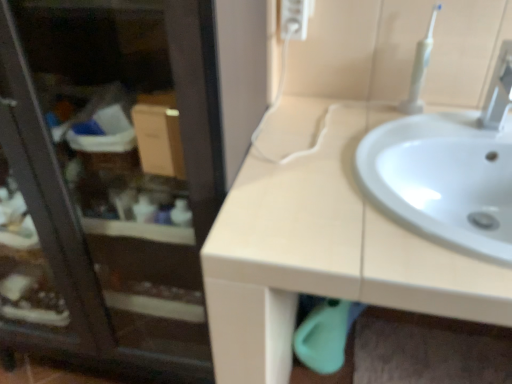
Question: Should I look upward or downward to see transparent glass screen door at upper left?

Choices:
 (A) up
 (B) down

Answer: (B)

Question: Can you confirm if white plastic tap at upper right is taller than white plastic toothbrush at upper right?

Choices:
 (A) yes
 (B) no

Answer: (B)

Question: From the image's perspective, is white plastic tap at upper right over white plastic toothbrush at upper right?

Choices:
 (A) no
 (B) yes

Answer: (A)

Question: Does white plastic tap at upper right appear on the right side of white plastic toothbrush at upper right?

Choices:
 (A) no
 (B) yes

Answer: (B)

Question: Is white plastic toothbrush at upper right inside white plastic tap at upper right?

Choices:
 (A) no
 (B) yes

Answer: (A)

Question: Can you confirm if white plastic tap at upper right is smaller than white plastic toothbrush at upper right?

Choices:
 (A) no
 (B) yes

Answer: (A)

Question: Does white plastic tap at upper right come behind white plastic toothbrush at upper right?

Choices:
 (A) no
 (B) yes

Answer: (A)

Question: Considering the relative positions of beige matte sink at upper right and transparent glass screen door at upper left in the image provided, is beige matte sink at upper right behind transparent glass screen door at upper left?

Choices:
 (A) no
 (B) yes

Answer: (A)

Question: From the image's perspective, is beige matte sink at upper right under transparent glass screen door at upper left?

Choices:
 (A) yes
 (B) no

Answer: (A)

Question: Considering the relative positions of beige matte sink at upper right and transparent glass screen door at upper left in the image provided, is beige matte sink at upper right to the left of transparent glass screen door at upper left from the viewer's perspective?

Choices:
 (A) yes
 (B) no

Answer: (B)

Question: Is beige matte sink at upper right bigger than transparent glass screen door at upper left?

Choices:
 (A) no
 (B) yes

Answer: (B)

Question: Is transparent glass screen door at upper left a part of beige matte sink at upper right?

Choices:
 (A) yes
 (B) no

Answer: (B)

Question: From a real-world perspective, is beige matte sink at upper right located beneath transparent glass screen door at upper left?

Choices:
 (A) no
 (B) yes

Answer: (B)

Question: Is white plastic tap at upper right closer to camera compared to white glossy sink at center?

Choices:
 (A) no
 (B) yes

Answer: (A)